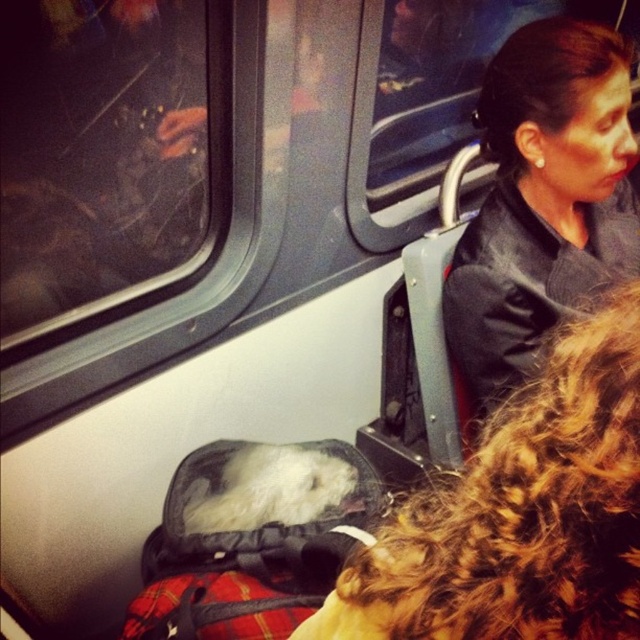
Is smooth black jacket at upper right shorter than black leather jacket at upper right?

Correct, smooth black jacket at upper right is not as tall as black leather jacket at upper right.

Where is `smooth black jacket at upper right`? The width and height of the screenshot is (640, 640). smooth black jacket at upper right is located at coordinates (518, 513).